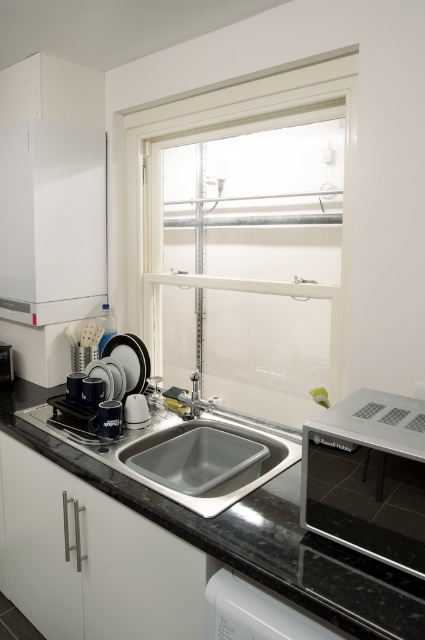
Is black granite countertop at center thinner than white glossy dishwasher at lower center?

No, black granite countertop at center is not thinner than white glossy dishwasher at lower center.

Between point (96, 477) and point (306, 624), which one is positioned in front?

Point (306, 624) is in front.

At what (x,y) coordinates should I click in order to perform the action: click on black granite countertop at center. Please return your answer as a coordinate pair (x, y). Image resolution: width=425 pixels, height=640 pixels. Looking at the image, I should click on (251, 538).

Is the position of white glass window at center more distant than that of satin nickel faucet at sink center?

Yes.

Who is higher up, white glass window at center or satin nickel faucet at sink center?

white glass window at center

I want to click on white glass window at center, so click(x=249, y=257).

Can you confirm if black granite countertop at center is positioned to the left of brushed metal toaster at lower left?

In fact, black granite countertop at center is to the right of brushed metal toaster at lower left.

What do you see at coordinates (251, 538) in the screenshot? The width and height of the screenshot is (425, 640). I see `black granite countertop at center` at bounding box center [251, 538].

Where is `black granite countertop at center`? The height and width of the screenshot is (640, 425). black granite countertop at center is located at coordinates (251, 538).